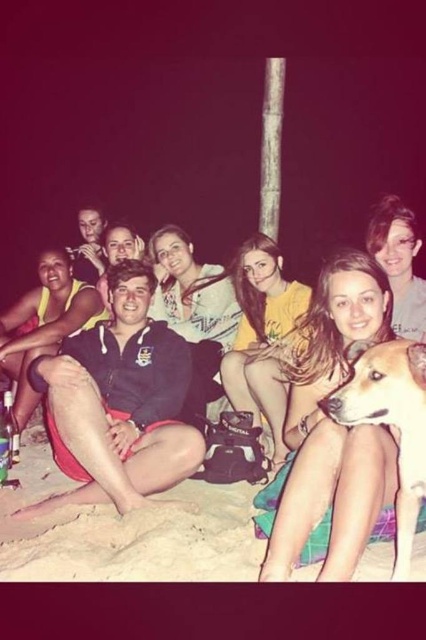
Between blonde hair at center and black matte jacket at center, which one is positioned lower?

blonde hair at center

Does point (351, 458) lie behind point (138, 260)?

No, it is in front of (138, 260).

Is point (325, 376) closer to camera compared to point (62, 397)?

Yes, it is.

Identify the location of blonde hair at center. (330, 433).

Between black matte jacket at center and sandy beach at lower center, which one is positioned higher?

black matte jacket at center is higher up.

Who is positioned more to the left, black matte jacket at center or sandy beach at lower center?

black matte jacket at center

Describe the element at coordinates (118, 401) in the screenshot. I see `black matte jacket at center` at that location.

Image resolution: width=426 pixels, height=640 pixels. What are the coordinates of `black matte jacket at center` in the screenshot? It's located at (118, 401).

Does matte black jacket at center lie in front of sandy beach at lower center?

Yes, it is in front of sandy beach at lower center.

Between matte black jacket at center and sandy beach at lower center, which one is positioned higher?

matte black jacket at center

Who is more distant from viewer, (x=389, y=252) or (x=80, y=509)?

Positioned behind is point (x=389, y=252).

What are the coordinates of `matte black jacket at center` in the screenshot? It's located at (325, 486).